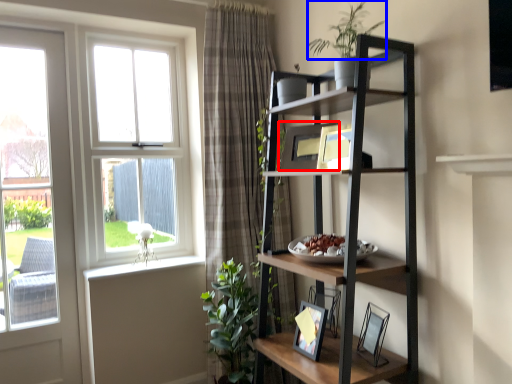
Question: Which of the following is the farthest to the observer, picture frame (highlighted by a red box) or vegetation (highlighted by a blue box)?

Choices:
 (A) picture frame
 (B) vegetation

Answer: (A)